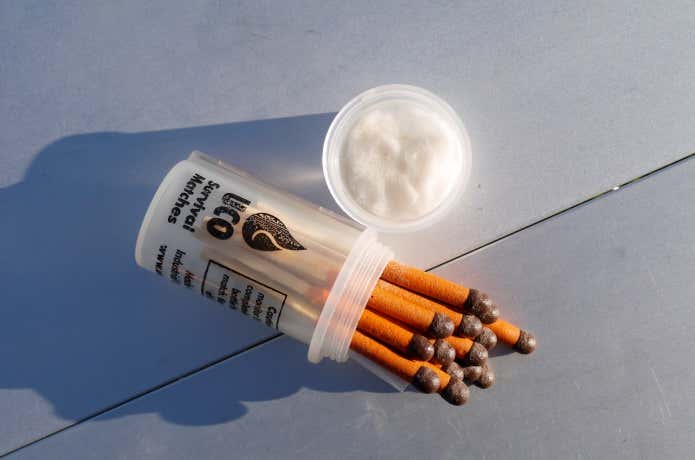
I want to click on bottle, so click(x=316, y=267).